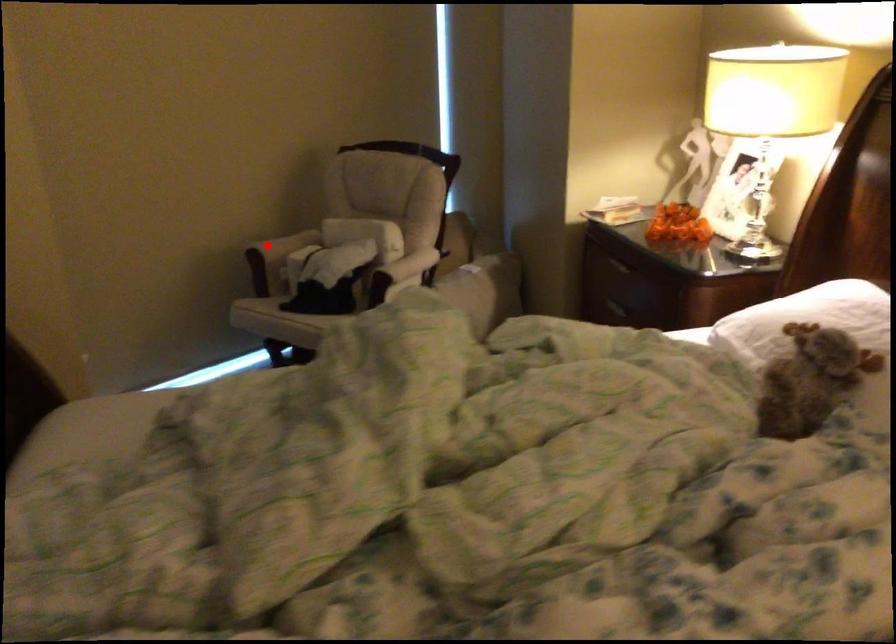
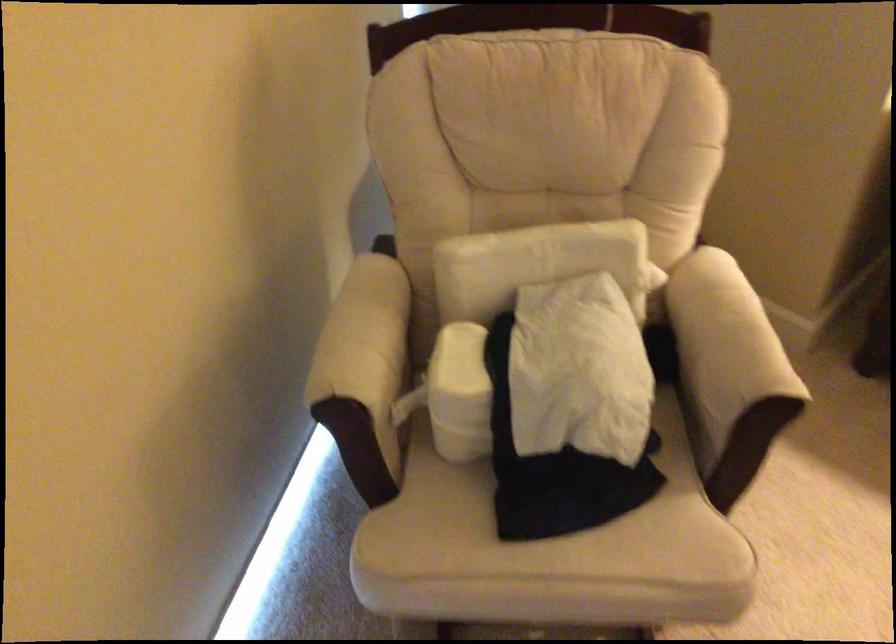
In the second image, find the point that corresponds to the highlighted location in the first image.

(364, 373)